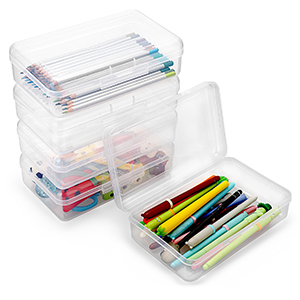
The width and height of the screenshot is (300, 300). I want to click on clearly visible pens, so click(x=232, y=247), click(x=216, y=248), click(x=211, y=245), click(x=203, y=242), click(x=199, y=238), click(x=207, y=216), click(x=197, y=217), click(x=188, y=216), click(x=168, y=215), click(x=161, y=210).